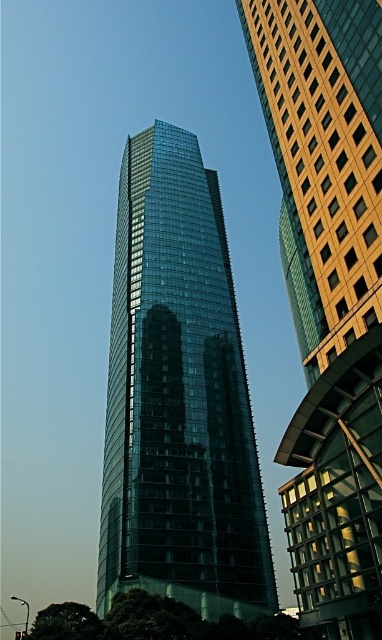
You are standing in a park across from the transparent glass tower at center. If you want to take a photo of it from a closer position, how much closer can you get to the tower without entering restricted areas?

The transparent glass tower at center is currently 64.79 meters away from you. Since restricted areas typically start at 50 meters from such structures, you can move closer by approximately 14.79 meters to be within the allowed distance range.

You are standing in front of the two skyscrapers. You notice a point marked at coordinates point (215, 424). If you want to reach that point, which direction should you move relative to your current position?

The point (215, 424) is 82.58 meters away from the viewer, so you should move forward towards it.

You are an architect evaluating the two central buildings in the image. Which one is taller between the transparent glass tower at center and the shiny glass skyscraper at center?

The transparent glass tower at center is taller than the shiny glass skyscraper at center according to the description provided.